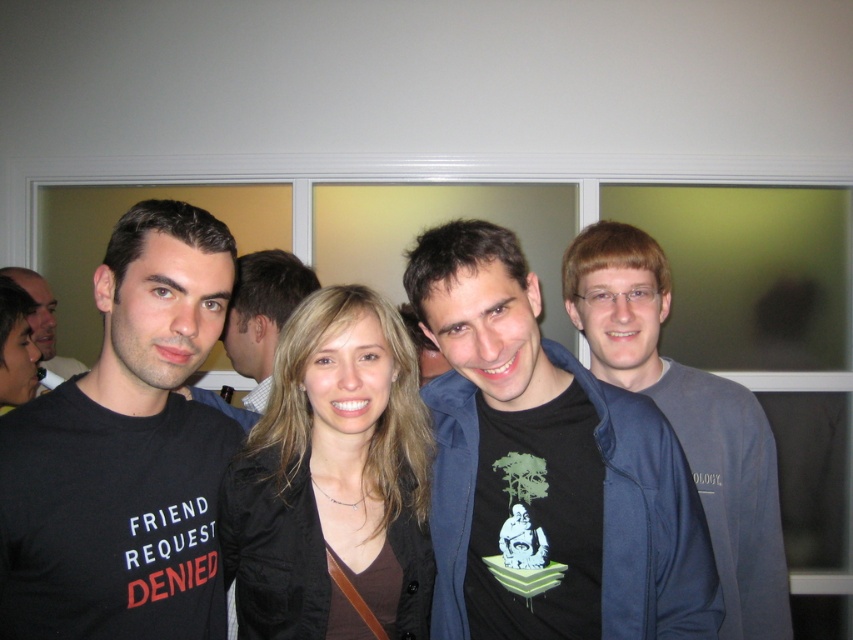
From the picture: Between gray fabric jacket at right and matte black t-shirt at left, which one has more height?

gray fabric jacket at right

Who is positioned more to the left, gray fabric jacket at right or matte black t-shirt at left?

matte black t-shirt at left

The height and width of the screenshot is (640, 853). Describe the element at coordinates (688, 417) in the screenshot. I see `gray fabric jacket at right` at that location.

Find the location of `gray fabric jacket at right`. gray fabric jacket at right is located at coordinates (688, 417).

Is black t-shirt with graphic at center shorter than matte black shirt at center?

No, black t-shirt with graphic at center is not shorter than matte black shirt at center.

Does point (589, 600) come farther from viewer compared to point (263, 301)?

That is False.

At what (x,y) coordinates should I click in order to perform the action: click on black t-shirt with graphic at center. Please return your answer as a coordinate pair (x, y). The height and width of the screenshot is (640, 853). Looking at the image, I should click on click(x=547, y=467).

How distant is blonde hair at center from matte black shirt at center?

A distance of 31.30 inches exists between blonde hair at center and matte black shirt at center.

Identify the location of blonde hair at center. The image size is (853, 640). (332, 476).

Is point (257, 499) less distant than point (256, 388)?

Yes, point (257, 499) is closer to viewer.

I want to click on blonde hair at center, so click(x=332, y=476).